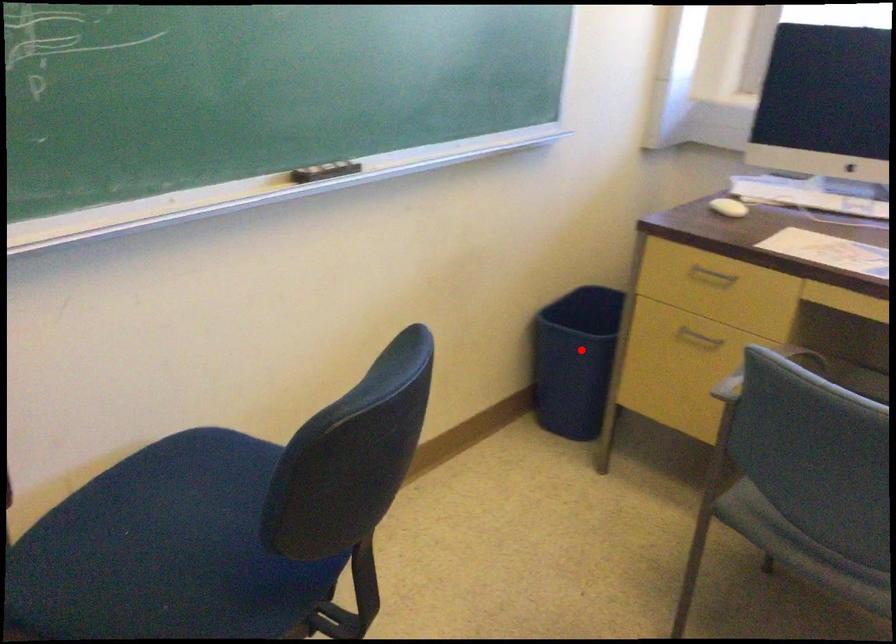
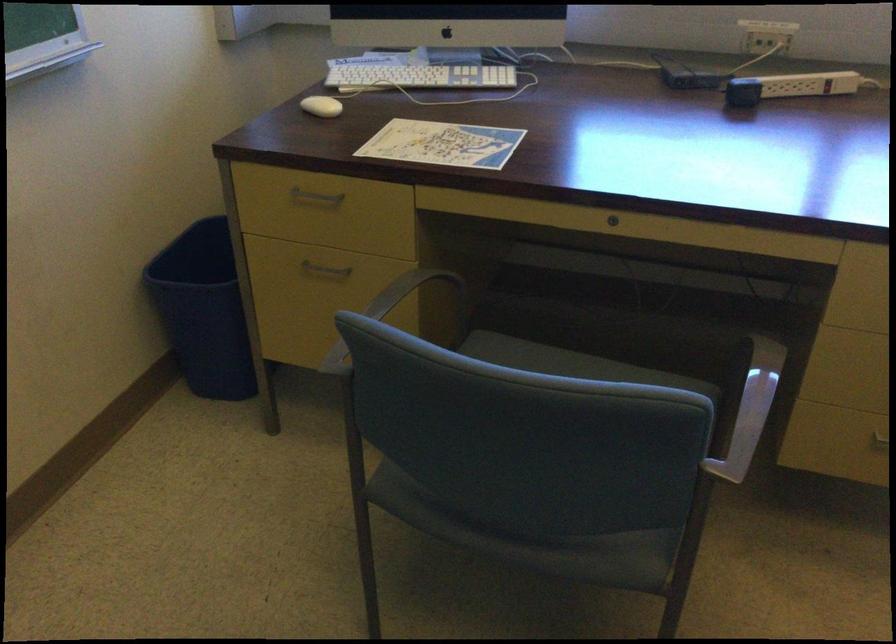
Find the pixel in the second image that matches the highlighted location in the first image.

(202, 310)